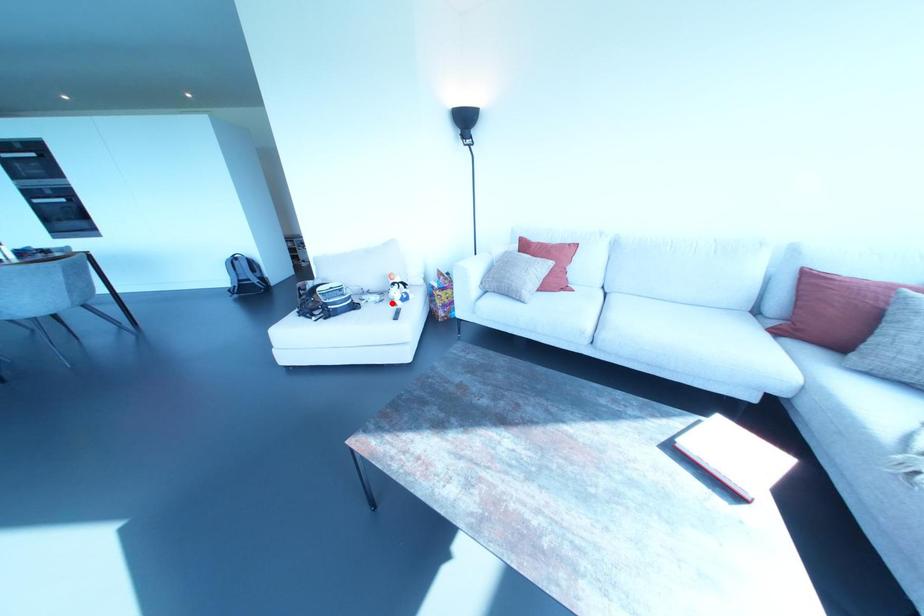
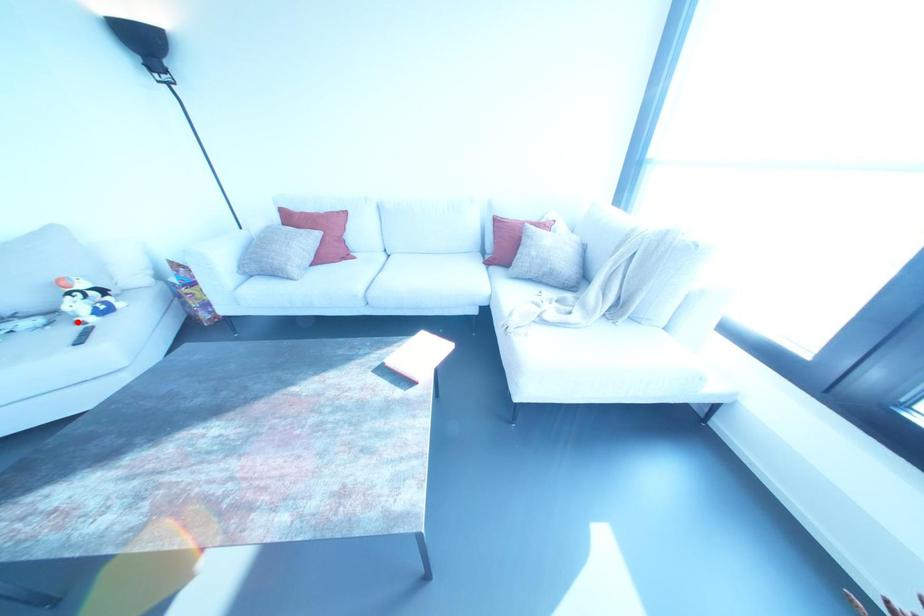
I am providing you with two images of the same scene from different viewpoints. A red point is marked on the first image and another point is marked on the second image. Does the point marked in image1 correspond to the same location as the one in image2?

Yes